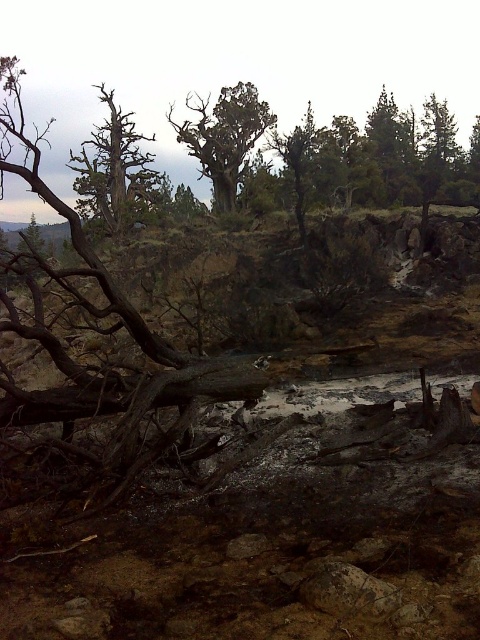
Question: Does dark brown wood at left have a lesser width compared to green textured tree at upper center?

Choices:
 (A) yes
 (B) no

Answer: (B)

Question: Which point is closer to the camera?

Choices:
 (A) green textured tree at upper center
 (B) green textured tree at center

Answer: (A)

Question: Can you confirm if green textured tree at center is thinner than green textured tree at upper center?

Choices:
 (A) no
 (B) yes

Answer: (A)

Question: Which point is closer to the camera?

Choices:
 (A) dead wood at left
 (B) green textured tree at center

Answer: (A)

Question: Is dead wood at left positioned at the back of green textured tree at center?

Choices:
 (A) yes
 (B) no

Answer: (B)

Question: Which object is the closest to the dark brown wood at left?

Choices:
 (A) green textured tree at upper center
 (B) dead wood at left

Answer: (B)